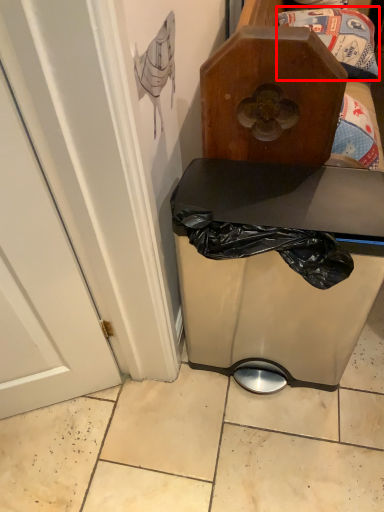
Question: From the image's perspective, considering the relative positions of waste (annotated by the red box) and furniture in the image provided, where is waste (annotated by the red box) located with respect to the staircase?

Choices:
 (A) below
 (B) above

Answer: (A)